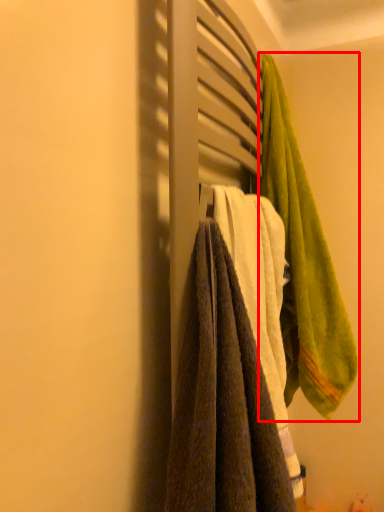
Question: Where is towel (annotated by the red box) located in relation to towel in the image?

Choices:
 (A) right
 (B) left

Answer: (A)